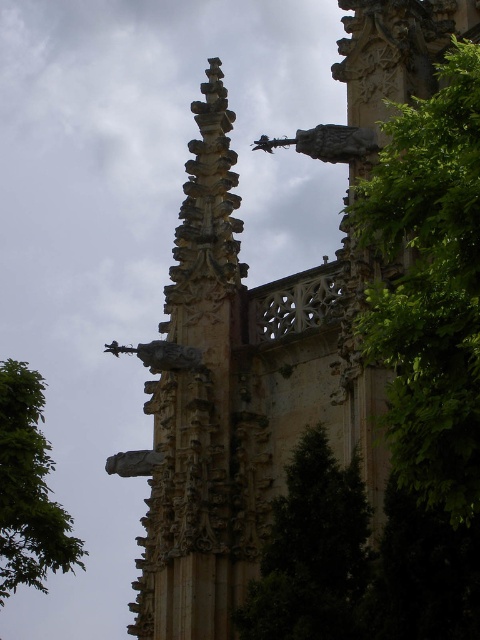
You are a tour guide leading a group through a Gothic cathedral. You want to ensure that visitors can comfortably walk between the green leafy tree at left and the polished stone statue at center without feeling cramped. The average width of a visitor is 0.5 meters. Can the path between them accommodate a single visitor comfortably?

The distance between the green leafy tree at left and the polished stone statue at center is 8.16 meters. Since the average visitor width is 0.5 meters, the path is sufficiently wide to allow comfortable passage for a single visitor.

You are standing in front of the Gothic structure and notice two green leafy trees in the scene. Which tree, the green leafy tree at right or the green leafy tree at center, is nearer to you?

The green leafy tree at right is closer to the viewer than the green leafy tree at center.

From the picture: You are standing in front of the Gothic structure and notice a green leafy tree at center and a polished stone statue at center. Which object is positioned lower in the scene?

The green leafy tree at center is located below the polished stone statue at center, so the green leafy tree at center is positioned lower in the scene.